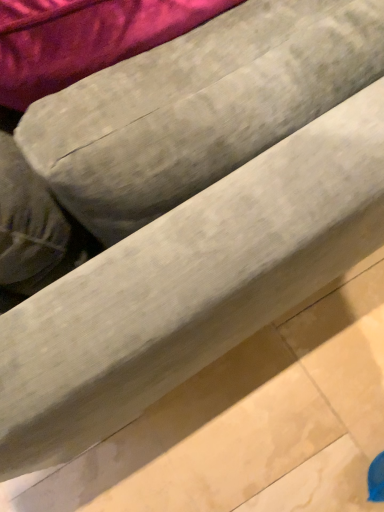
Where is `free location above beige marble tile at lower right (from a real-world perspective)`? Image resolution: width=384 pixels, height=512 pixels. free location above beige marble tile at lower right (from a real-world perspective) is located at coordinates (252, 428).